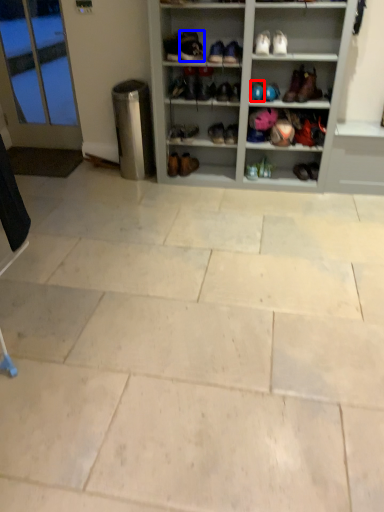
Question: Among these objects, which one is farthest to the camera, footwear (highlighted by a red box) or shoe (highlighted by a blue box)?

Choices:
 (A) footwear
 (B) shoe

Answer: (A)